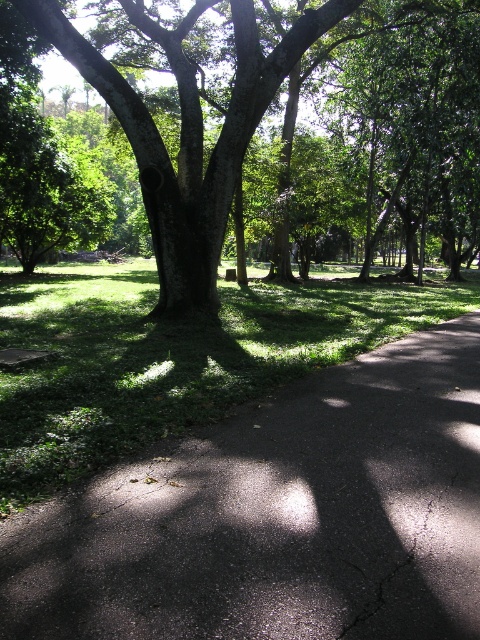
You are a gardener planning to plant a new flower bed between the black asphalt pavement at center and the green rough bark tree at center. Based on their positions, which object should you place the flowers closer to?

The black asphalt pavement at center is located below the green rough bark tree at center, so you should place the flowers closer to the black asphalt pavement at center to avoid the tree roots potentially damaging the plants.

You are a landscape architect designing a new park. You want to place a bench along the black asphalt pavement at center so that it is as close as possible to the green rough bark tree at center without being under the tree. Based on the scene description, where should you position the bench relative to the tree?

The bench should be placed near the edge of the black asphalt pavement at center closest to the green rough bark tree at center but not under its branches, since the tree occupies more space and its branches spread over the path.

You are a pedestrian standing at the entrance of the park. You see the black asphalt pavement at center and the green rough bark tree at center. Which object is closer to you?

The black asphalt pavement at center is closer to the viewer than the green rough bark tree at center.